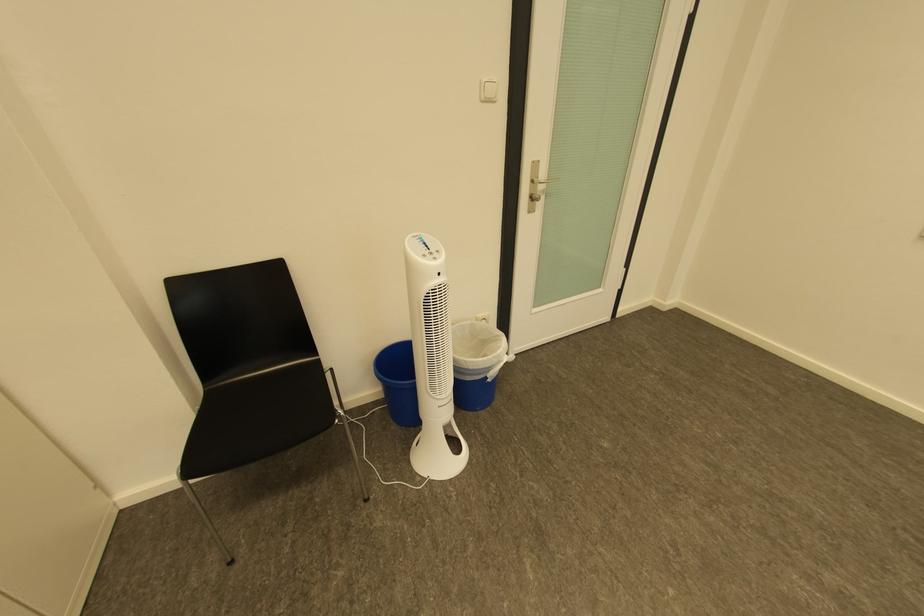
Find where to sit the chair sitting surface. Please return your answer as a coordinate pair (x, y).

(251, 419)